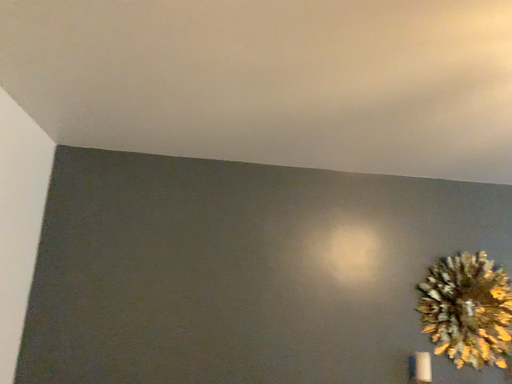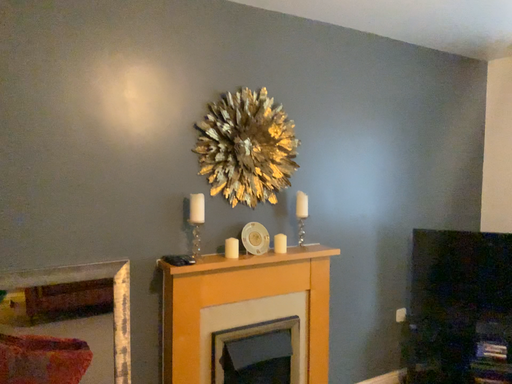
Question: How did the camera likely rotate when shooting the video?

Choices:
 (A) rotated right
 (B) rotated left

Answer: (A)